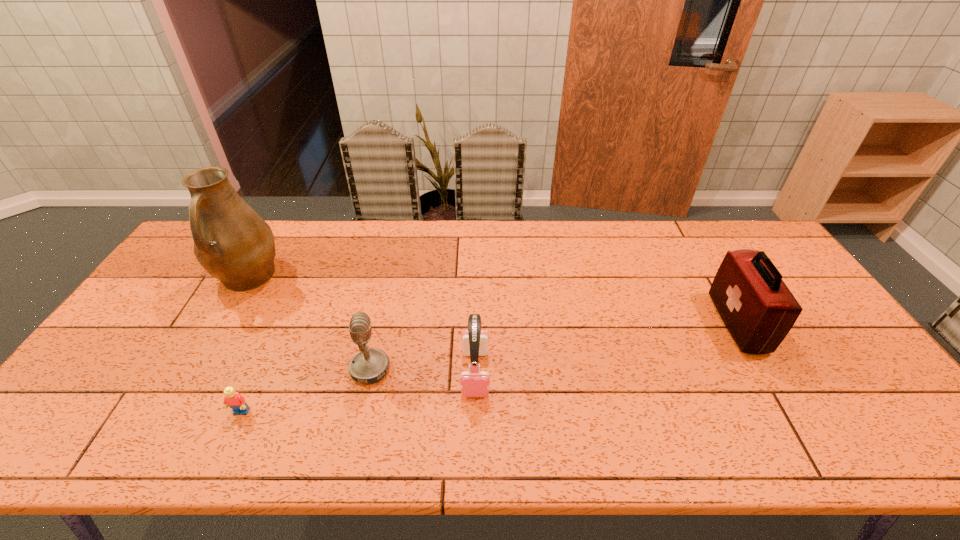
The image size is (960, 540). What are the coordinates of `the tallest object` in the screenshot? It's located at (232, 242).

This screenshot has width=960, height=540. Identify the location of the leftmost object. (232, 242).

The image size is (960, 540). In order to click on the first aid kit in this screenshot , I will do `click(758, 309)`.

Image resolution: width=960 pixels, height=540 pixels. In order to click on the third object from left to right in this screenshot , I will do `click(369, 365)`.

This screenshot has height=540, width=960. Identify the location of earphone. (474, 383).

Locate an element on the screen. the shortest object is located at coordinates (233, 399).

The image size is (960, 540). Find the location of `Lego`. Lego is located at coordinates (233, 399).

The height and width of the screenshot is (540, 960). In order to click on vacant space located 0.200m on the handle side of the tallest object in this screenshot , I will do `click(199, 361)`.

Where is `free space located on the side of the first aid kit with the cross symbol`? free space located on the side of the first aid kit with the cross symbol is located at coordinates (625, 323).

At what (x,y) coordinates should I click in order to perform the action: click on vacant area located 0.190m on the side of the first aid kit with the cross symbol. Please return your answer as a coordinate pair (x, y). Looking at the image, I should click on (653, 323).